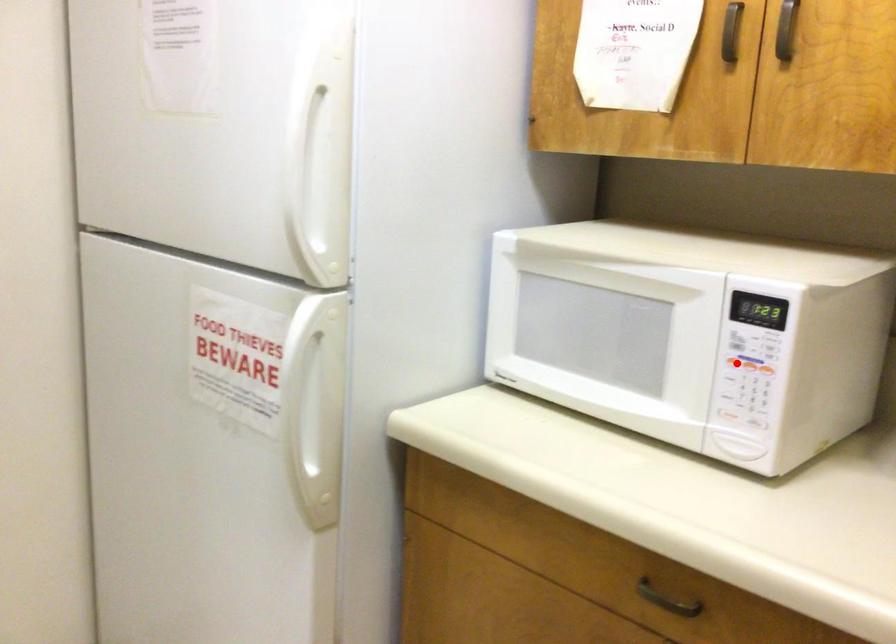
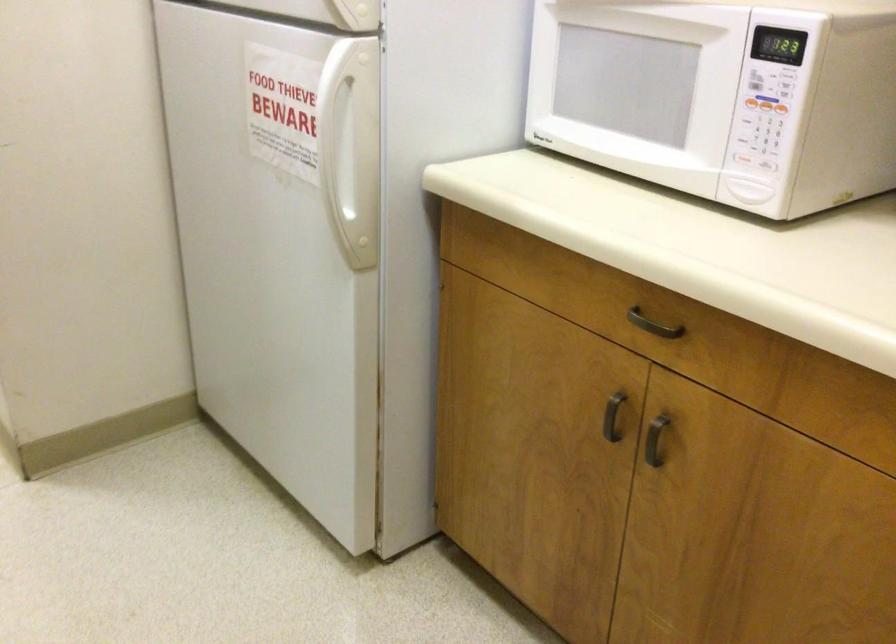
Find the pixel in the second image that matches the highlighted location in the first image.

(752, 102)